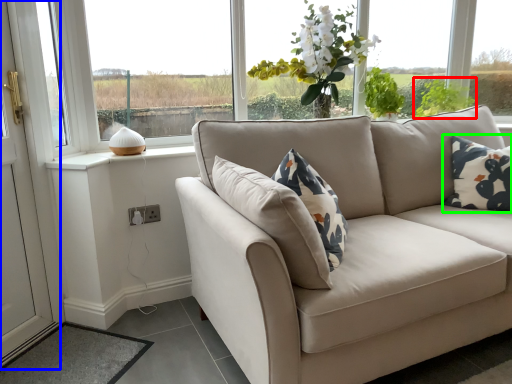
Question: Estimate the real-world distances between objects in this image. Which object is closer to plant (highlighted by a red box), screen door (highlighted by a blue box) or pillow (highlighted by a green box)?

Choices:
 (A) screen door
 (B) pillow

Answer: (B)